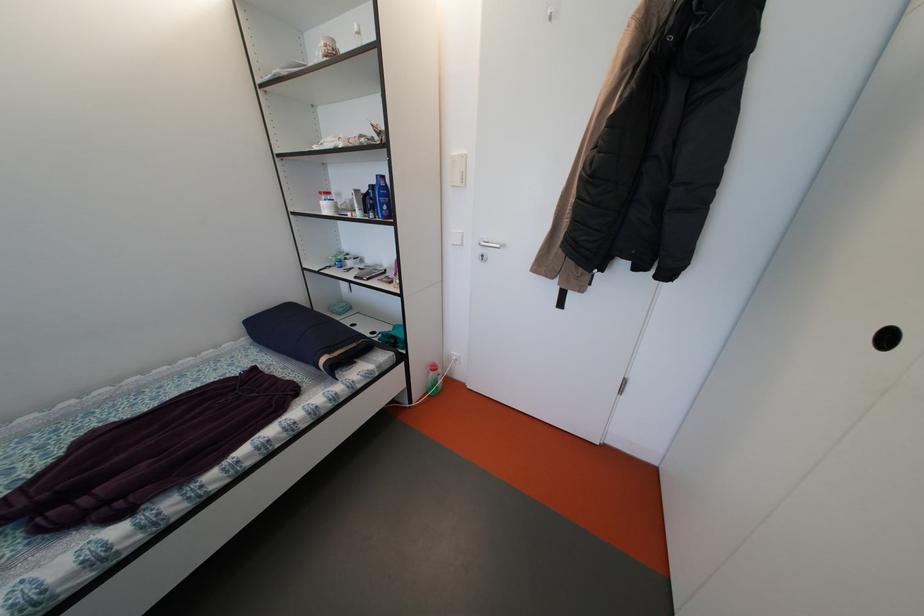
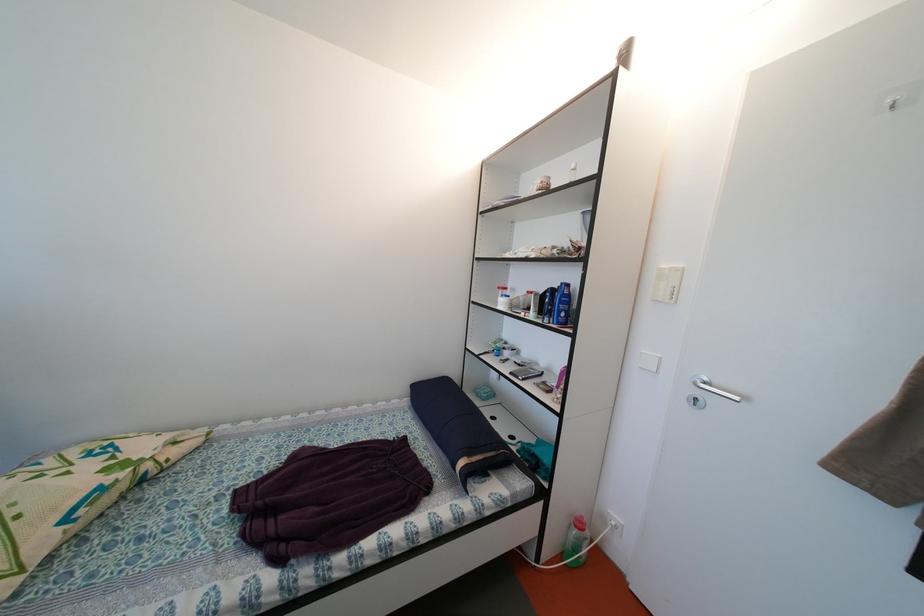
Locate, in the second image, the point that corresponds to [490,261] in the first image.

(703, 405)